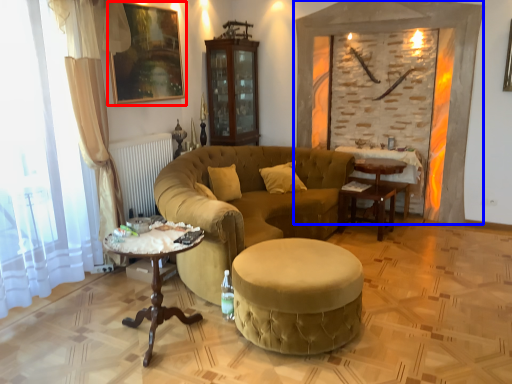
Question: Which point is closer to the camera, picture frame (highlighted by a red box) or fireplace (highlighted by a blue box)?

Choices:
 (A) picture frame
 (B) fireplace

Answer: (A)